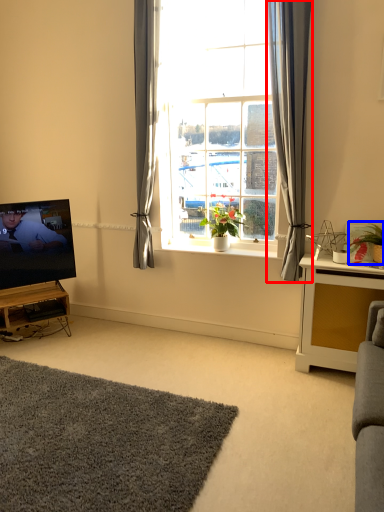
Question: Which point is further to the camera, curtain (highlighted by a red box) or houseplant (highlighted by a blue box)?

Choices:
 (A) curtain
 (B) houseplant

Answer: (B)